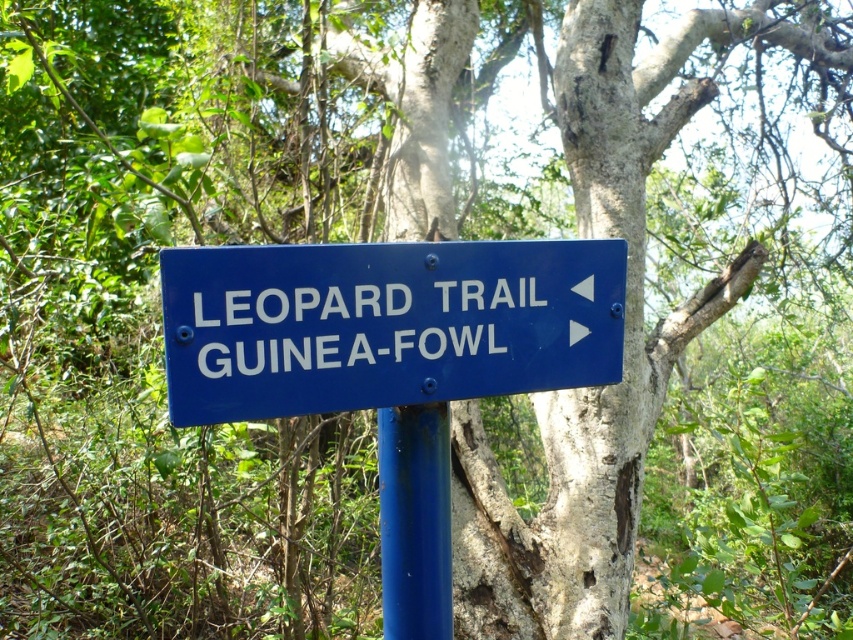
Question: Which point appears closest to the camera in this image?

Choices:
 (A) click(x=173, y=378)
 (B) click(x=395, y=577)

Answer: (A)

Question: Is blue plastic sign at center to the right of blue painted metal pole at center from the viewer's perspective?

Choices:
 (A) no
 (B) yes

Answer: (B)

Question: Is blue plastic sign at center to the right of blue painted metal pole at center from the viewer's perspective?

Choices:
 (A) no
 (B) yes

Answer: (B)

Question: Can you confirm if blue plastic sign at center is wider than blue painted metal pole at center?

Choices:
 (A) yes
 (B) no

Answer: (A)